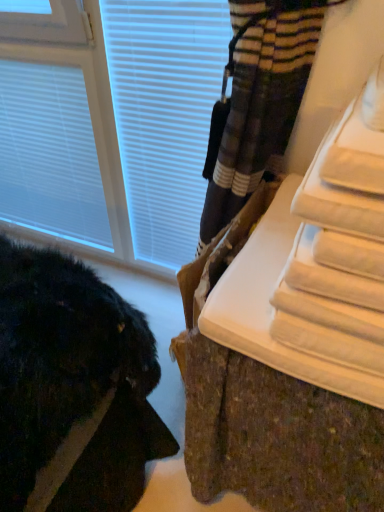
This screenshot has height=512, width=384. Describe the element at coordinates (51, 154) in the screenshot. I see `white matte blind at upper left` at that location.

Describe the element at coordinates (293, 340) in the screenshot. I see `white textured radiator at lower right` at that location.

Where is `white matte blind at upper left`? Image resolution: width=384 pixels, height=512 pixels. white matte blind at upper left is located at coordinates (51, 154).

Is white plastic window at upper left far away from white matte blind at upper left?

white plastic window at upper left is actually quite close to white matte blind at upper left.

Does point (7, 93) come farther from viewer compared to point (94, 183)?

No, (7, 93) is closer to viewer.

How much distance is there between white plastic window at upper left and white matte blind at upper left?

A distance of 2.88 inches exists between white plastic window at upper left and white matte blind at upper left.

From the image's perspective, is white plastic window at upper left on top of white matte blind at upper left?

No.

Considering the sizes of objects white matte blind at upper left and white textured radiator at lower right in the image provided, who is smaller, white matte blind at upper left or white textured radiator at lower right?

white matte blind at upper left.

From the image's perspective, is white matte blind at upper left located above white textured radiator at lower right?

Yes, from the image's perspective, white matte blind at upper left is above white textured radiator at lower right.

Does white matte blind at upper left lie behind white textured radiator at lower right?

Yes, it is.

From the image's perspective, is white matte blind at upper left under white plastic window at upper left?

No, from the image's perspective, white matte blind at upper left is not below white plastic window at upper left.

Is white matte blind at upper left facing away from white plastic window at upper left?

That's right, white matte blind at upper left is facing away from white plastic window at upper left.

From a real-world perspective, who is located higher, white matte blind at upper left or white plastic window at upper left?

white plastic window at upper left is physically above.

Would you say white textured radiator at lower right is inside or outside white matte blind at upper left?

A: white textured radiator at lower right lies outside white matte blind at upper left.

Can you confirm if white textured radiator at lower right is wider than white matte blind at upper left?

Yes.

Is white textured radiator at lower right positioned with its back to white matte blind at upper left?

No, white textured radiator at lower right's orientation is not away from white matte blind at upper left.

Between white textured radiator at lower right and white matte blind at upper left, which one appears on the right side from the viewer's perspective?

From the viewer's perspective, white textured radiator at lower right appears more on the right side.

In the image, is white textured radiator at lower right positioned in front of or behind white plastic window at upper left?

white textured radiator at lower right is positioned closer to the viewer than white plastic window at upper left.

From the picture: In terms of size, does white textured radiator at lower right appear bigger or smaller than white plastic window at upper left?

In the image, white textured radiator at lower right appears to be smaller than white plastic window at upper left.

Considering the sizes of objects white textured radiator at lower right and white plastic window at upper left in the image provided, who is shorter, white textured radiator at lower right or white plastic window at upper left?

With less height is white textured radiator at lower right.

Is white textured radiator at lower right not close to white plastic window at upper left?

white textured radiator at lower right is actually quite close to white plastic window at upper left.

From the picture: Measure the distance from white plastic window at upper left to white textured radiator at lower right.

white plastic window at upper left and white textured radiator at lower right are 30.82 inches apart from each other.

The image size is (384, 512). I want to click on window that is above the white textured radiator at lower right (from a real-world perspective), so click(x=111, y=125).

Between white plastic window at upper left and white textured radiator at lower right, which one is positioned in front?

white textured radiator at lower right is closer to the camera.

From the image's perspective, is white plastic window at upper left located above or below white textured radiator at lower right?

From the image's perspective, white plastic window at upper left appears above white textured radiator at lower right.

The image size is (384, 512). What are the coordinates of `window in front of the white matte blind at upper left` in the screenshot? It's located at (111, 125).

The height and width of the screenshot is (512, 384). Identify the location of furniture below the white matte blind at upper left (from the image's perspective). (293, 340).

Looking at the image, which one is located closer to white matte blind at upper left, white textured radiator at lower right or white plastic window at upper left?

white plastic window at upper left.

From the image, which object appears to be farther from white textured radiator at lower right, white matte blind at upper left or white plastic window at upper left?

white matte blind at upper left.

When comparing their distances from white plastic window at upper left, does white matte blind at upper left or white textured radiator at lower right seem further?

Among the two, white textured radiator at lower right is located further to white plastic window at upper left.

Estimate the real-world distances between objects in this image. Which object is further from white plastic window at upper left, white textured radiator at lower right or white matte blind at upper left?

white textured radiator at lower right is positioned further to the anchor white plastic window at upper left.

Considering their positions, is white plastic window at upper left positioned closer to white matte blind at upper left than white textured radiator at lower right?

The object closer to white matte blind at upper left is white plastic window at upper left.

Considering their positions, is white plastic window at upper left positioned closer to white textured radiator at lower right than white matte blind at upper left?

Among the two, white plastic window at upper left is located nearer to white textured radiator at lower right.

What are the coordinates of `window located between white matte blind at upper left and white textured radiator at lower right in the left-right direction` in the screenshot? It's located at (111, 125).